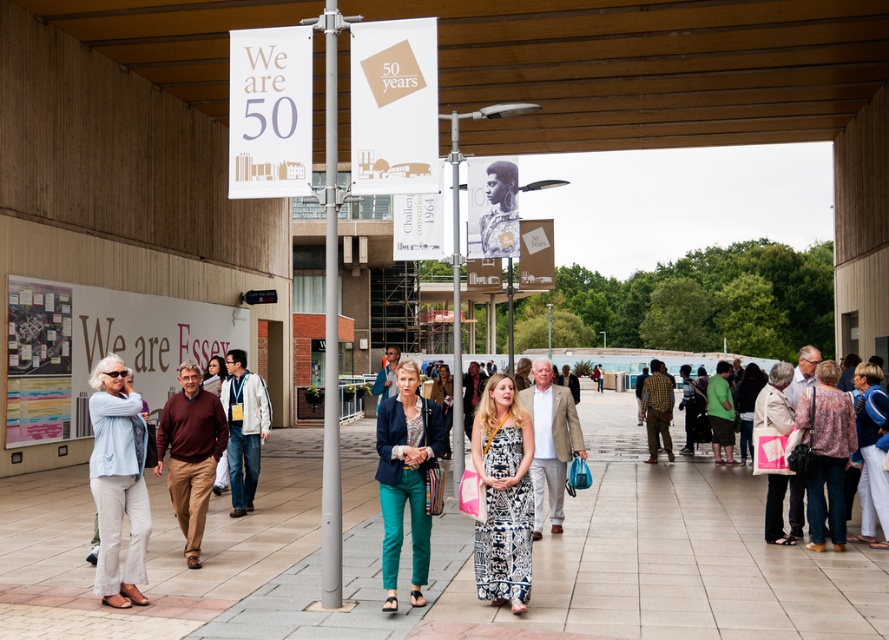
You are a photographer at the event and want to capture a photo of both the patterned fabric dress at center and the beige fabric handbag at lower right. Can you ensure both are in focus without moving the camera?

The patterned fabric dress at center is in front of the beige fabric handbag at lower right, so if you focus on the dress, the handbag may be slightly out of focus. To ensure both are in focus, adjust the camera to a smaller aperture for a deeper depth of field.

You are a photographer at the event and need to ensure that both the patterned fabric dress at center and the beige fabric handbag at lower right are clearly visible in your shot. Given their sizes, which object might require more space in the frame to capture its full detail?

The patterned fabric dress at center requires more space in the frame because its width is larger than the beige fabric handbag at lower right.

You are standing at the event and want to take a photo of the white paper banner at upper left without any obstructions. Since the smooth concrete pavement at center is between you and the banner, will you be able to take the photo without the pavement blocking the banner?

The smooth concrete pavement at center is closer to the viewer than the white paper banner at upper left, so the pavement will block the banner in your photo.